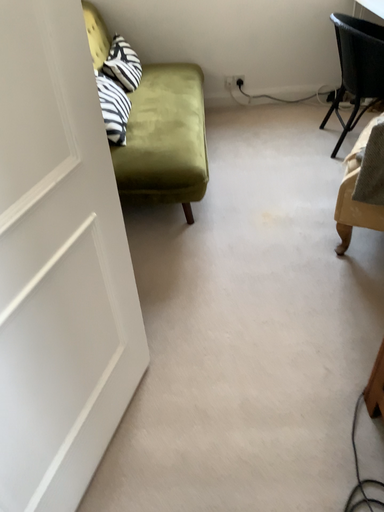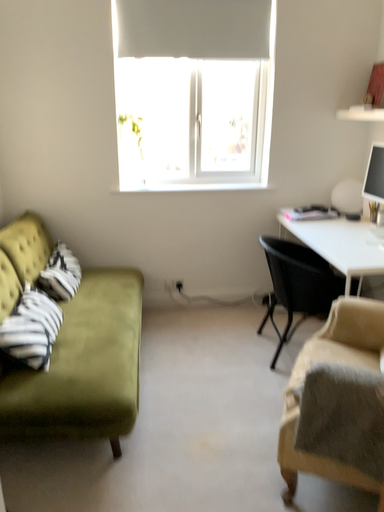
Question: How did the camera likely rotate when shooting the video?

Choices:
 (A) rotated downward
 (B) rotated upward

Answer: (B)